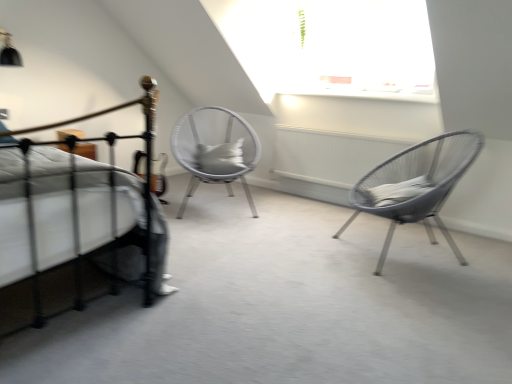
Image resolution: width=512 pixels, height=384 pixels. What are the coordinates of `vacant area in front of white woven chair at center, acting as the 2th chair starting from the front` in the screenshot? It's located at (232, 230).